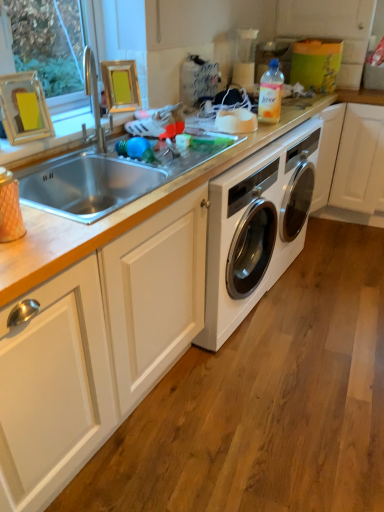
Question: Can we say white matte cabinet at center lies outside silver metallic sink at upper left?

Choices:
 (A) no
 (B) yes

Answer: (B)

Question: Is white matte cabinet at center aimed at silver metallic sink at upper left?

Choices:
 (A) no
 (B) yes

Answer: (A)

Question: Are white matte cabinet at center and silver metallic sink at upper left beside each other?

Choices:
 (A) no
 (B) yes

Answer: (A)

Question: Is white matte cabinet at center facing away from silver metallic sink at upper left?

Choices:
 (A) no
 (B) yes

Answer: (A)

Question: Considering the relative sizes of white matte cabinet at center and silver metallic sink at upper left in the image provided, is white matte cabinet at center smaller than silver metallic sink at upper left?

Choices:
 (A) yes
 (B) no

Answer: (B)

Question: From a real-world perspective, is white glossy washing machine at center physically located above or below white matte cabinet at center?

Choices:
 (A) below
 (B) above

Answer: (B)

Question: Based on their positions, is white glossy washing machine at center located to the left or right of white matte cabinet at center?

Choices:
 (A) left
 (B) right

Answer: (B)

Question: Considering their positions, is white glossy washing machine at center located in front of or behind white matte cabinet at center?

Choices:
 (A) behind
 (B) front

Answer: (A)

Question: Does point (278, 217) appear closer or farther from the camera than point (59, 295)?

Choices:
 (A) farther
 (B) closer

Answer: (A)

Question: Based on their sizes in the image, would you say white glossy washing machine at center is bigger or smaller than silver metallic sink at upper left?

Choices:
 (A) big
 (B) small

Answer: (A)

Question: Is white glossy washing machine at center inside the boundaries of silver metallic sink at upper left, or outside?

Choices:
 (A) outside
 (B) inside

Answer: (A)

Question: From a real-world perspective, is white glossy washing machine at center above or below silver metallic sink at upper left?

Choices:
 (A) above
 (B) below

Answer: (B)

Question: Considering the positions of point (301, 195) and point (91, 180), is point (301, 195) closer or farther from the camera than point (91, 180)?

Choices:
 (A) farther
 (B) closer

Answer: (A)

Question: From the image's perspective, is white glossy washing machine at center positioned above or below translucent plastic bottle at upper right?

Choices:
 (A) above
 (B) below

Answer: (B)

Question: Is white glossy washing machine at center bigger or smaller than translucent plastic bottle at upper right?

Choices:
 (A) small
 (B) big

Answer: (B)